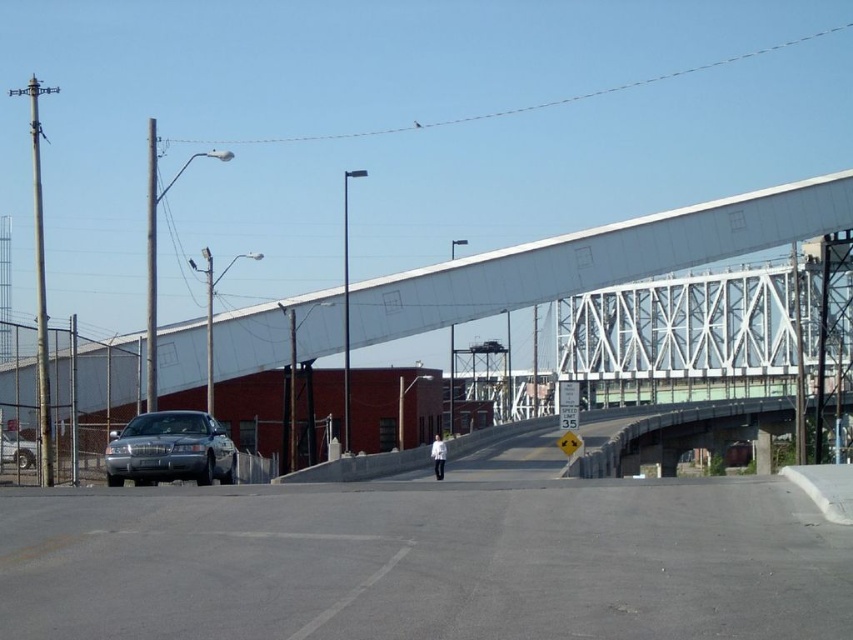
You are a pedestrian standing on the road under the white metallic bridge at center. You want to cross the road to reach the white matte jacket at center. Is the jacket closer to you or further away than the bridge?

The white metallic bridge at center is closer to the viewer than the white matte jacket at center, so the jacket is further away from you than the bridge.

You are a pedestrian standing at the edge of the road near the chain link fence. You see the satin silver sedan at center and the white matte jacket at center. Which object is closer to you?

The satin silver sedan at center is closer to you because it is in front of the white matte jacket at center.

You are driving a 3.5 meter long truck and want to park it between the satin silver sedan at center and the shiny silver sedan at left. Can the truck fit in the space between them?

The satin silver sedan at center is 4.16 meters away from the shiny silver sedan at left. Since the truck is 3.5 meters long, it can fit in the space between them as there is enough distance.